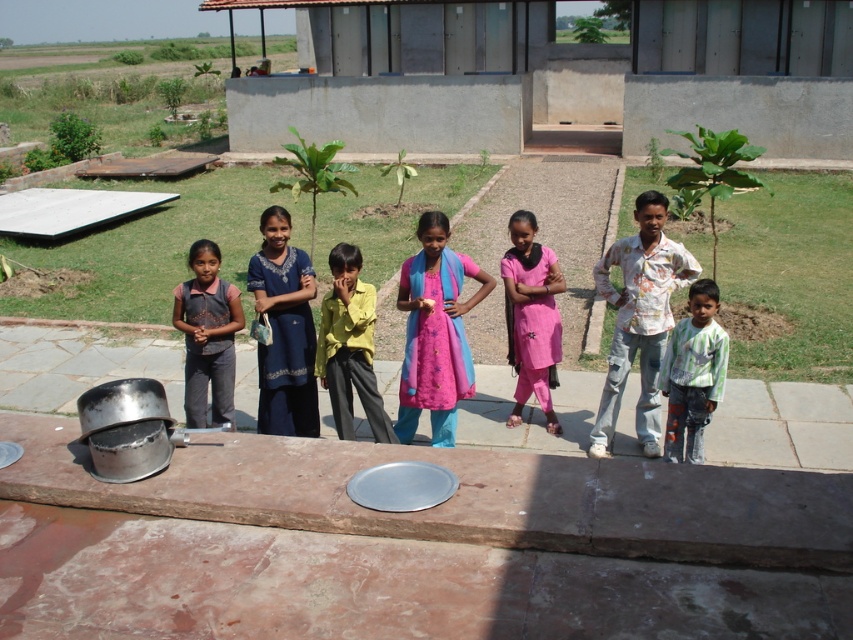
You are a photographer trying to capture a group shot of the children. You want to ensure that the pink fabric dress at center and the yellow matte shirt at center are both visible in the frame. Which child should you position closer to the front to avoid blocking the other?

The yellow matte shirt at center should be positioned closer to the front because the pink fabric dress at center is taller than the yellow matte shirt at center. This way, the shorter yellow matte shirt at center won

You are standing at the point labeled point (x=549, y=358) and want to take a photo of the children. The camera you have can focus on subjects within 6 meters. Will the camera be able to capture the children clearly?

The point labeled point (x=549, y=358) and the camera are 6.22 meters apart. Since the camera can focus within 6 meters, the distance is slightly beyond its range, so the children may not be captured clearly.

You are a photographer trying to capture a group photo of the children. You notice the pink fabric dress at center and the striped cotton shirt at center. Which clothing item should you focus on first if you want to ensure the larger one is in sharp focus?

The pink fabric dress at center is bigger than the striped cotton shirt at center, so you should focus on the pink fabric dress at center first to ensure it is in sharp focus.